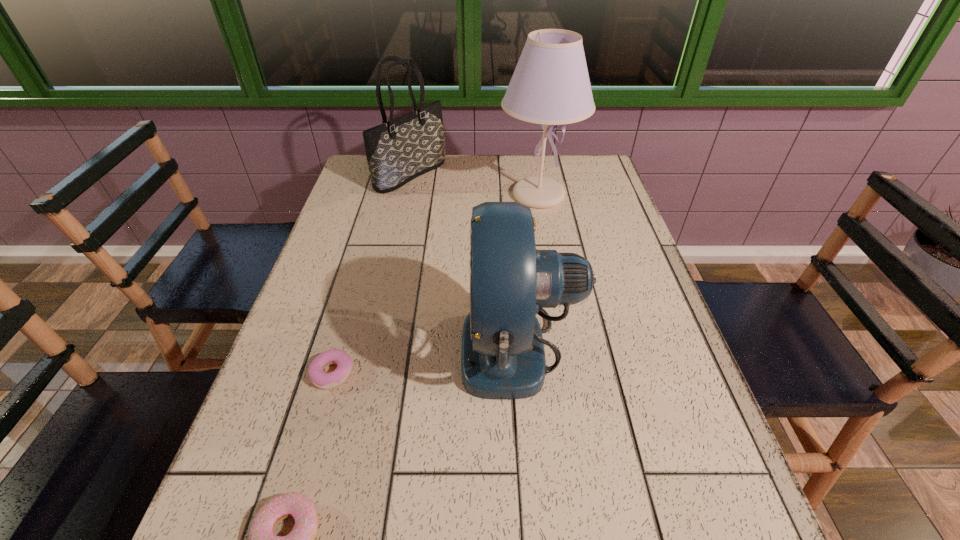
The width and height of the screenshot is (960, 540). I want to click on free space at the far right corner, so click(x=563, y=178).

In order to click on empty space that is in between the tallest object and the pastry in this screenshot , I will do `click(436, 284)`.

Identify the location of unoccupied area between the tote bag and the shortest object. This screenshot has height=540, width=960. (372, 274).

This screenshot has height=540, width=960. In order to click on empty space between the shortest object and the fan in this screenshot , I will do `click(425, 360)`.

The width and height of the screenshot is (960, 540). I want to click on vacant area that lies between the shortest object and the tote bag, so click(372, 274).

The width and height of the screenshot is (960, 540). I want to click on free space between the fan and the shortest object, so click(x=425, y=360).

Identify the location of empty space that is in between the lampshade and the tote bag. (475, 185).

Where is `free space between the tallest object and the pastry`? The width and height of the screenshot is (960, 540). free space between the tallest object and the pastry is located at coordinates (436, 284).

Identify the location of free area in between the shortest object and the tote bag. (372, 274).

Point out which object is positioned as the fourth nearest to the tote bag. Please provide its 2D coordinates. Your answer should be formatted as a tuple, i.e. [(x, y)], where the tuple contains the x and y coordinates of a point satisfying the conditions above.

[(301, 539)]